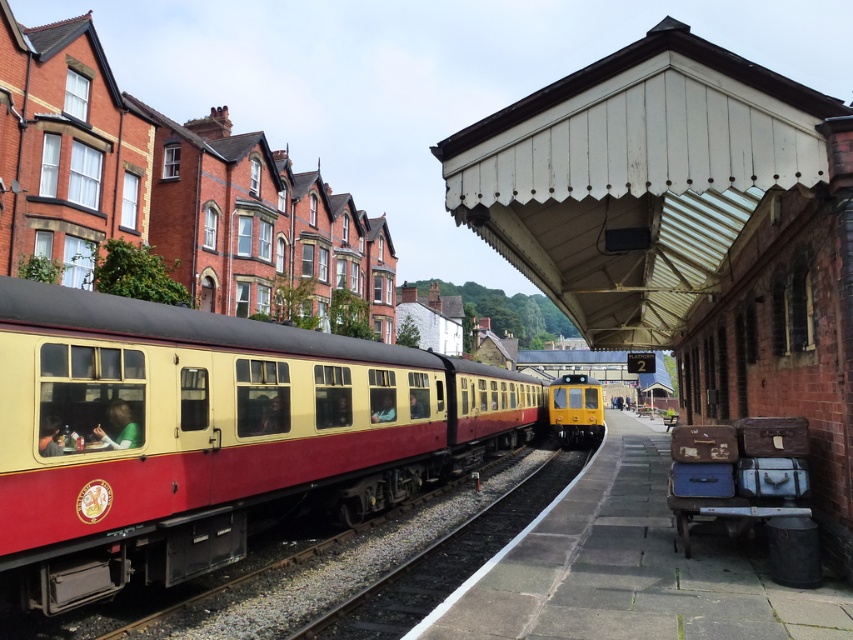
Is matte cream train at center in front of smooth metal train track at center?

Yes.

In the scene shown: Is matte cream train at center wider than smooth metal train track at center?

Yes.

Looking at this image, who is more forward, (178, 470) or (430, 602)?

Point (178, 470)

Where is `matte cream train at center`? matte cream train at center is located at coordinates (210, 433).

Which of these two, smooth metal train track at center or yellow matte train at center, stands shorter?

smooth metal train track at center is shorter.

Does smooth metal train track at center appear on the right side of yellow matte train at center?

No, smooth metal train track at center is not to the right of yellow matte train at center.

Which is behind, point (544, 499) or point (596, 403)?

The point (596, 403) is more distant.

Find the location of a particular element. smooth metal train track at center is located at coordinates (444, 561).

What do you see at coordinates (210, 433) in the screenshot?
I see `matte cream train at center` at bounding box center [210, 433].

Does matte cream train at center have a smaller size compared to yellow matte train at center?

Yes.

What do you see at coordinates (210, 433) in the screenshot?
I see `matte cream train at center` at bounding box center [210, 433].

In order to click on matte cream train at center in this screenshot , I will do `click(210, 433)`.